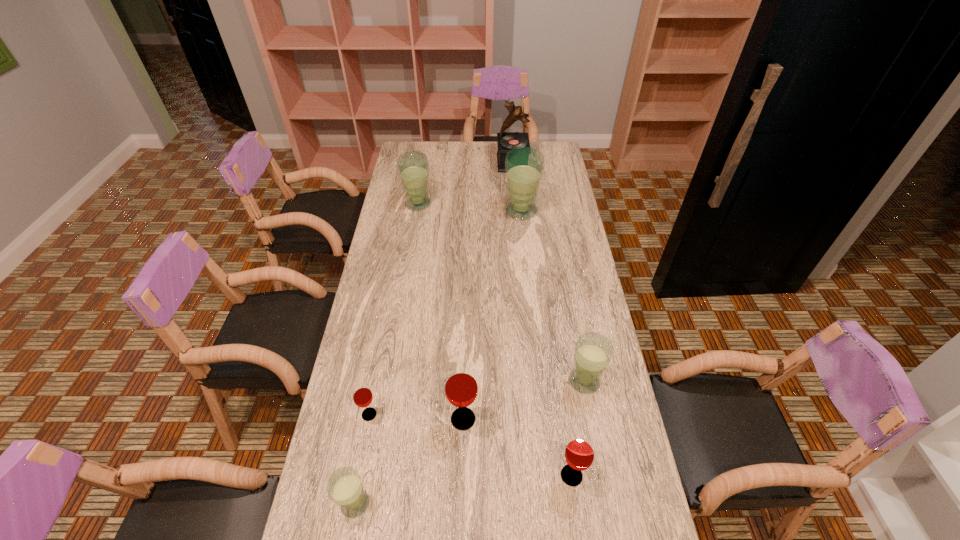
Where is `free space that satisfies the following two spatial constraints: 1. on the front side of the smallest red glass; 2. on the right side of the nearest red glass`? This screenshot has height=540, width=960. free space that satisfies the following two spatial constraints: 1. on the front side of the smallest red glass; 2. on the right side of the nearest red glass is located at coordinates (358, 476).